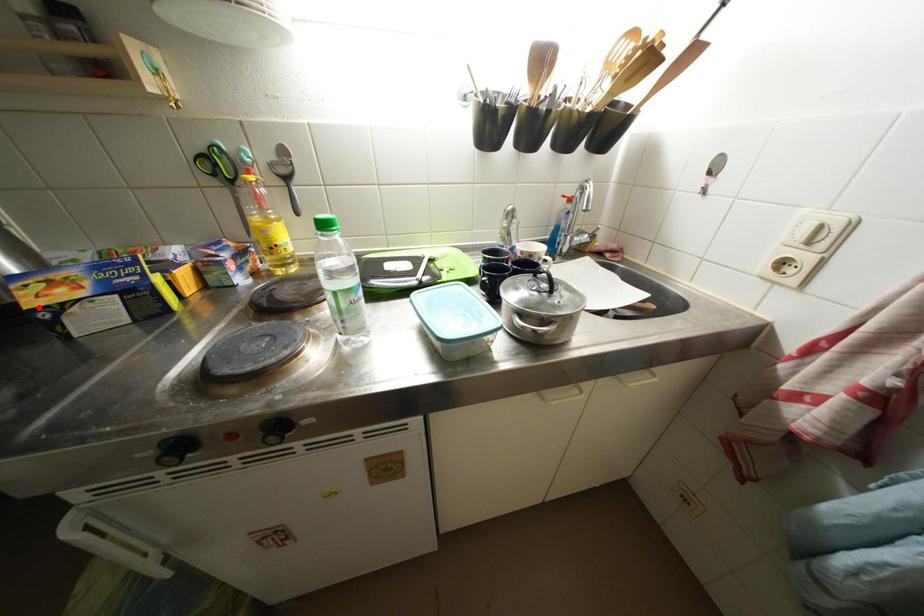
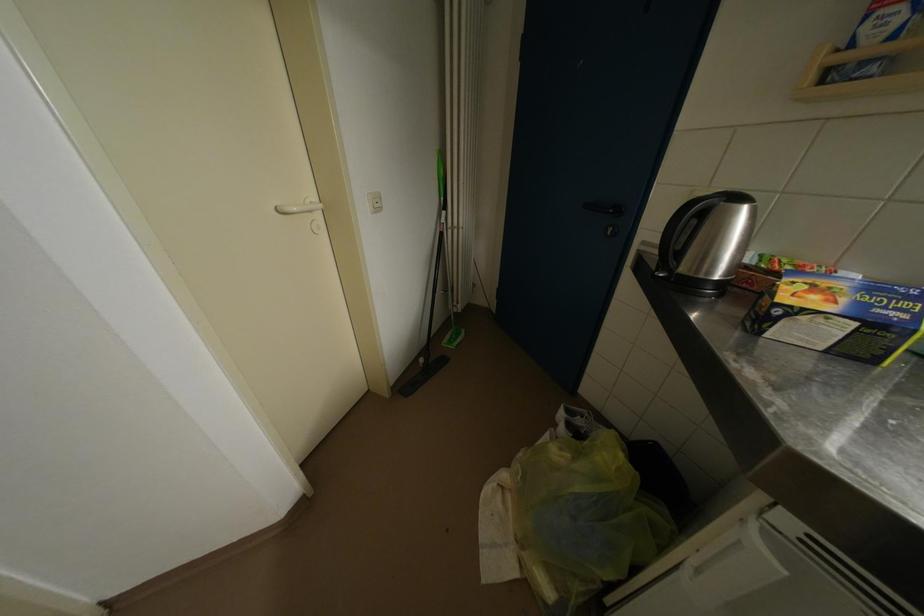
The point at the highlighted location is marked in the first image. Where is the corresponding point in the second image?

(791, 302)